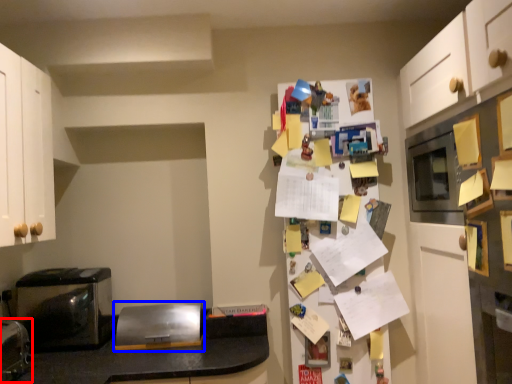
Question: Which point is further to the camera, appliance (highlighted by a red box) or appliance (highlighted by a blue box)?

Choices:
 (A) appliance
 (B) appliance

Answer: (B)